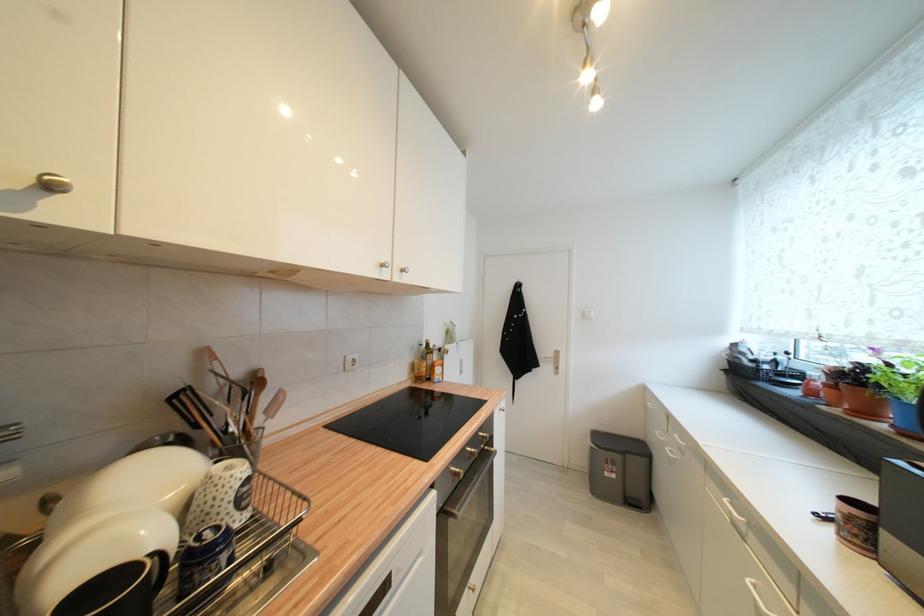
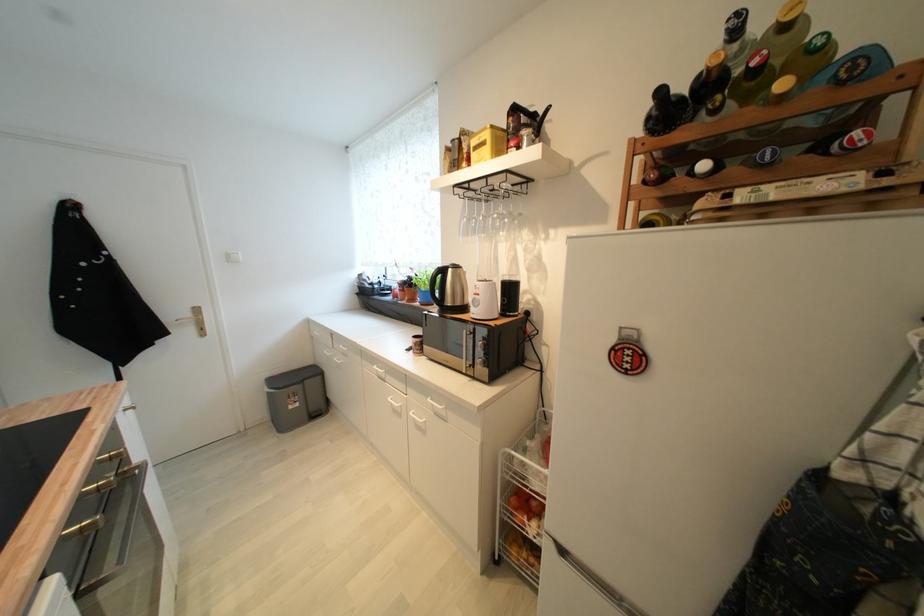
In the second image, find the point that corresponds to (612,476) in the first image.

(296, 408)